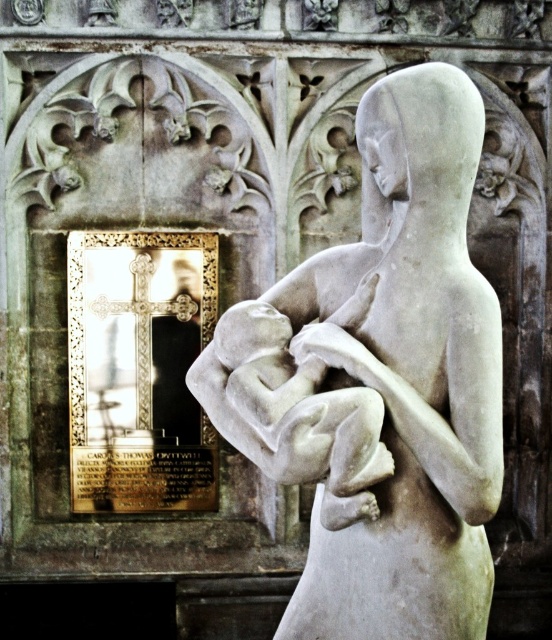
Question: Is white marble statue at center positioned in front of smooth white baby at center?

Choices:
 (A) yes
 (B) no

Answer: (B)

Question: Which point appears farthest from the camera in this image?

Choices:
 (A) (246, 387)
 (B) (379, 152)

Answer: (B)

Question: Is white marble statue at center closer to camera compared to smooth white baby at center?

Choices:
 (A) yes
 (B) no

Answer: (B)

Question: Does white marble statue at center come behind smooth white baby at center?

Choices:
 (A) no
 (B) yes

Answer: (B)

Question: Among these objects, which one is nearest to the camera?

Choices:
 (A) white marble statue at center
 (B) smooth white baby at center

Answer: (B)

Question: Which of the following is the farthest from the observer?

Choices:
 (A) (333, 630)
 (B) (338, 444)

Answer: (A)